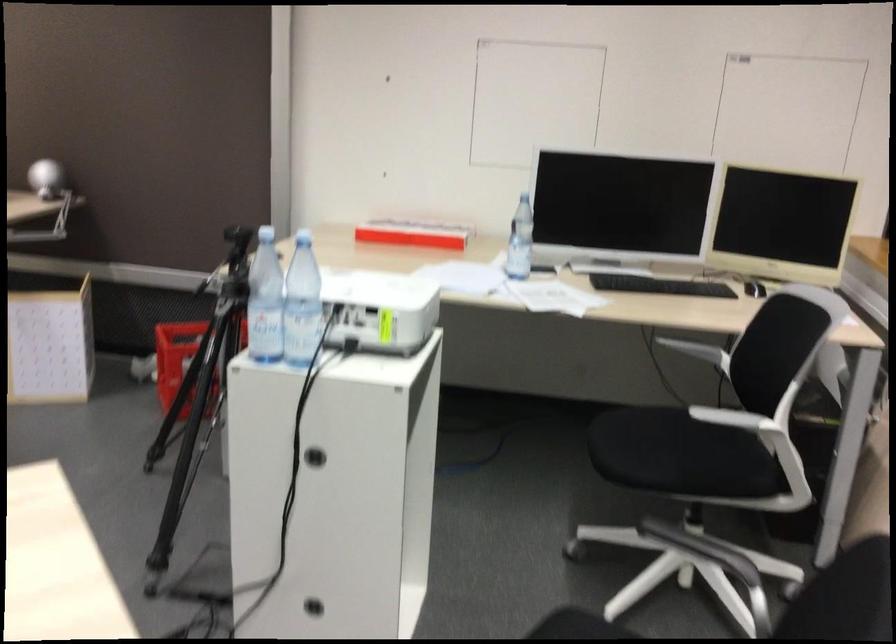
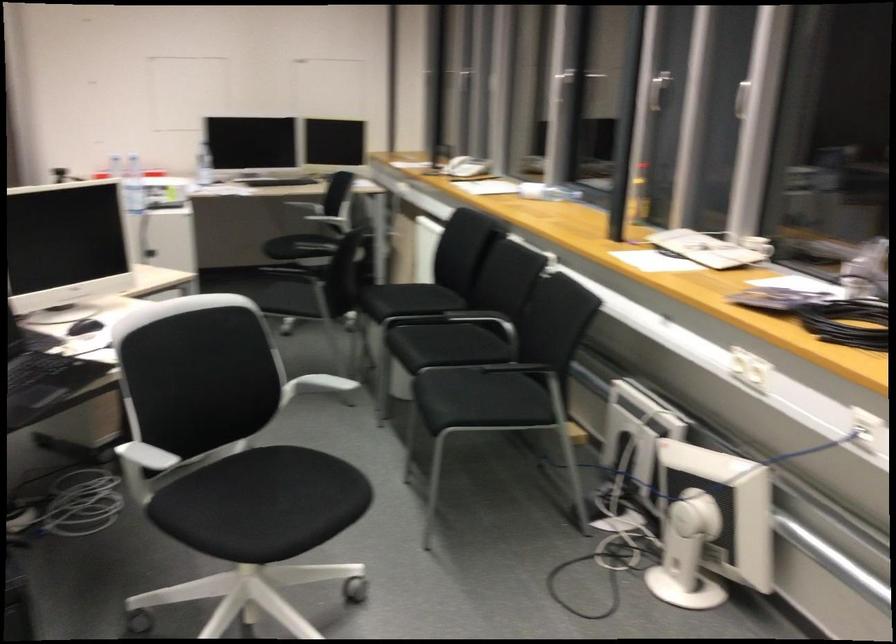
Find the pixel in the second image that matches [679,455] in the first image.

(309, 240)